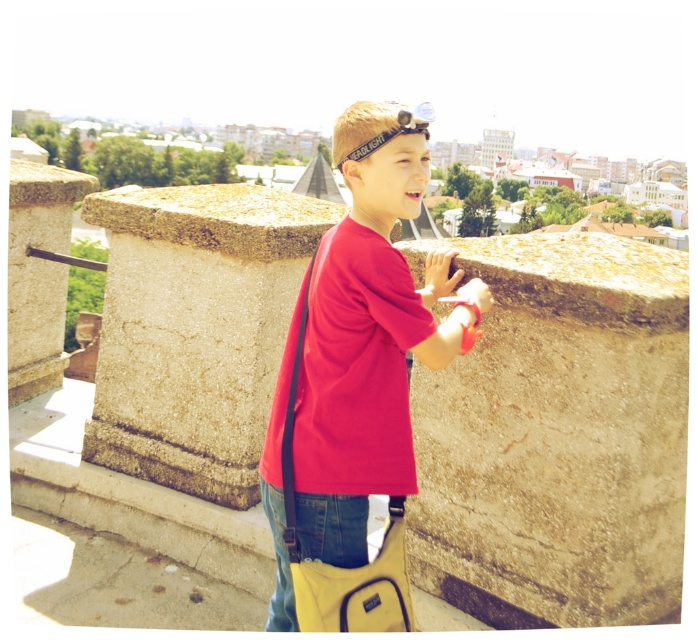
Is point (144, 323) farther from viewer compared to point (353, 296)?

Yes, point (144, 323) is behind point (353, 296).

Between granite-like stone pillar at center and matte red t-shirt at center, which one is positioned lower?

matte red t-shirt at center

Does point (259, 342) lie behind point (359, 348)?

Yes, it is.

Identify the location of granite-like stone pillar at center. This screenshot has width=697, height=640. (194, 330).